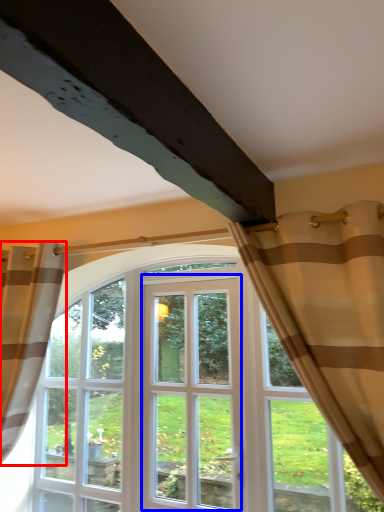
Question: Which object is closer to the camera taking this photo, curtain (highlighted by a red box) or screen door (highlighted by a blue box)?

Choices:
 (A) curtain
 (B) screen door

Answer: (A)